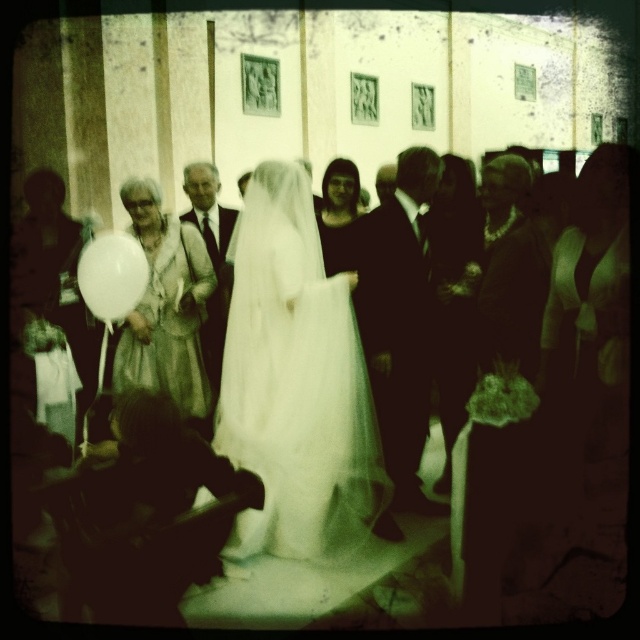
Question: Is the position of matte black suit at right more distant than that of silver sequined dress at left?

Choices:
 (A) no
 (B) yes

Answer: (A)

Question: Is silver sequined dress at left to the right of matte black dress at center from the viewer's perspective?

Choices:
 (A) no
 (B) yes

Answer: (A)

Question: Based on their relative distances, which object is nearer to the white sheer dress at center?

Choices:
 (A) white satin dress at center
 (B) light brown suit at center

Answer: (B)

Question: Estimate the real-world distances between objects in this image. Which object is closer to the matte black dress at center?

Choices:
 (A) light brown suit at center
 (B) silky white dress at center

Answer: (B)

Question: Which of the following is the farthest from the observer?

Choices:
 (A) silky white dress at center
 (B) shiny black suit at center
 (C) white satin dress at center
 (D) white sheer dress at center

Answer: (A)

Question: Can you confirm if white sheer dress at center is positioned above white matte balloon at left?

Choices:
 (A) no
 (B) yes

Answer: (A)